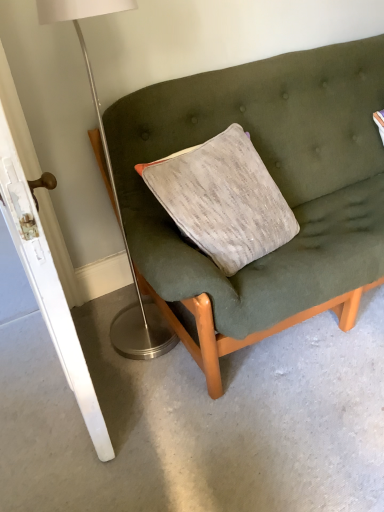
Question: Should I look upward or downward to see white glossy door at left?

Choices:
 (A) down
 (B) up

Answer: (B)

Question: Is the depth of white glossy door at left less than that of textured fabric couch at center?

Choices:
 (A) no
 (B) yes

Answer: (B)

Question: From a real-world perspective, is white glossy door at left beneath textured fabric couch at center?

Choices:
 (A) yes
 (B) no

Answer: (B)

Question: Is white glossy door at left oriented away from textured fabric couch at center?

Choices:
 (A) yes
 (B) no

Answer: (A)

Question: Is white glossy door at left located outside textured fabric couch at center?

Choices:
 (A) yes
 (B) no

Answer: (A)

Question: Can you confirm if white glossy door at left is shorter than textured fabric couch at center?

Choices:
 (A) no
 (B) yes

Answer: (A)

Question: Is white glossy door at left far away from textured fabric couch at center?

Choices:
 (A) no
 (B) yes

Answer: (A)

Question: Is textured fabric couch at center outside of white glossy door at left?

Choices:
 (A) yes
 (B) no

Answer: (A)

Question: Is textured fabric couch at center thinner than white glossy door at left?

Choices:
 (A) no
 (B) yes

Answer: (A)

Question: Can you confirm if textured fabric couch at center is smaller than white glossy door at left?

Choices:
 (A) no
 (B) yes

Answer: (B)

Question: Is textured fabric couch at center touching white glossy door at left?

Choices:
 (A) yes
 (B) no

Answer: (B)

Question: Would you say textured fabric couch at center is a long distance from white glossy door at left?

Choices:
 (A) no
 (B) yes

Answer: (A)

Question: Does textured fabric couch at center have a greater height compared to white glossy door at left?

Choices:
 (A) yes
 (B) no

Answer: (B)

Question: Are textured fabric couch at center and metallic silver floor lamp at left making contact?

Choices:
 (A) yes
 (B) no

Answer: (B)